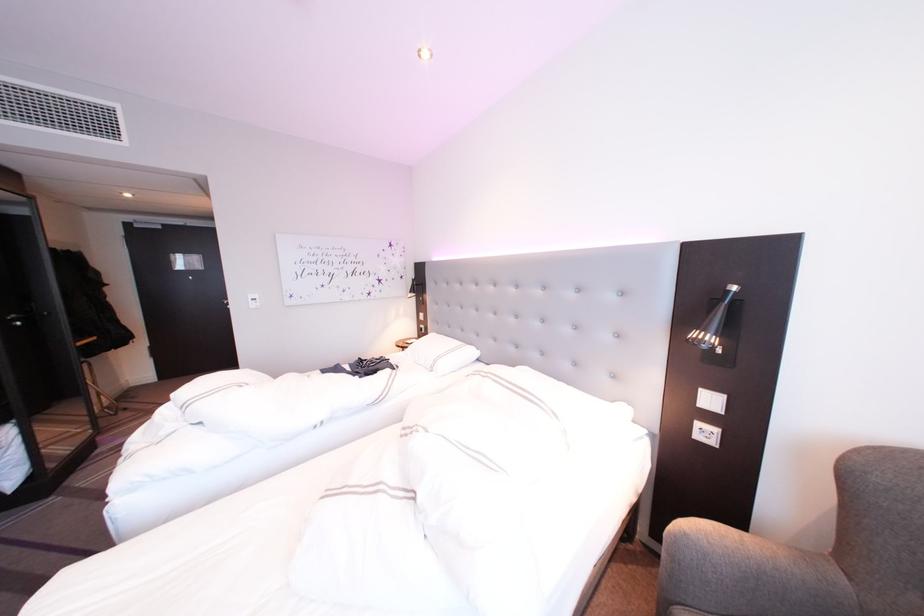
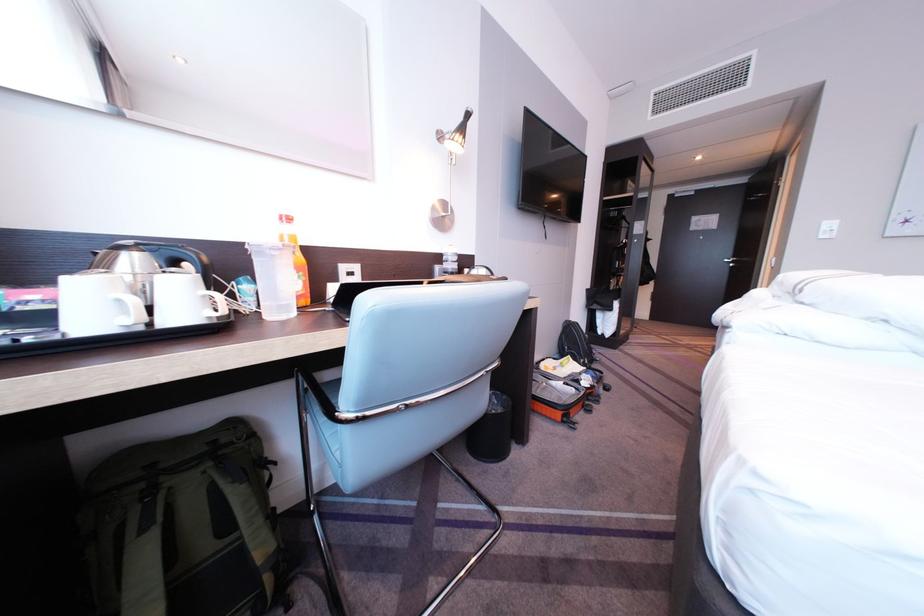
Question: Based on the continuous images, in which direction is the camera rotating? Reply with the corresponding letter.

Choices:
 (A) Left
 (B) Right
 (C) Up
 (D) Down

Answer: (A)